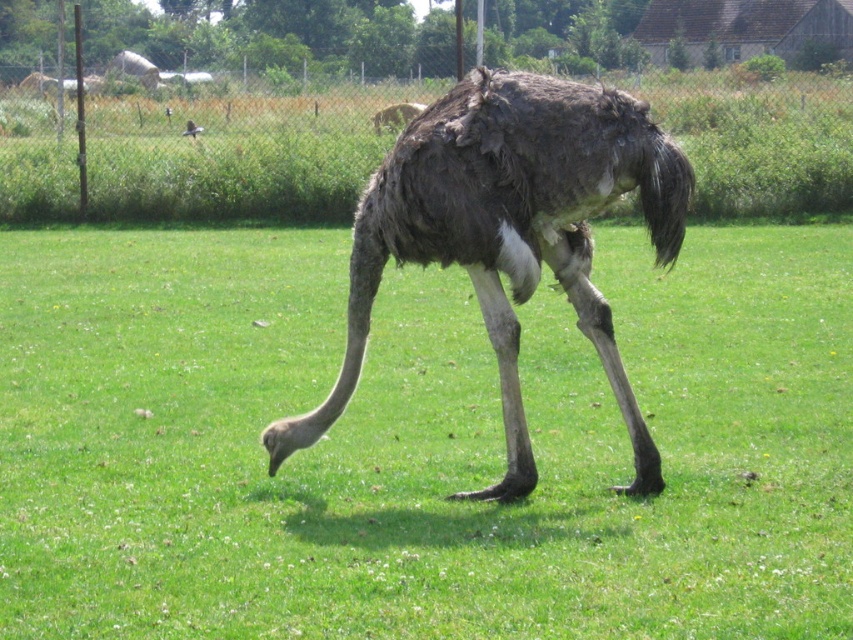
Question: Considering the relative positions of green grass at center and shiny black bird at upper left in the image provided, where is green grass at center located with respect to shiny black bird at upper left?

Choices:
 (A) left
 (B) right

Answer: (B)

Question: Which object is positioned farthest from the green grass at center?

Choices:
 (A) dark brown feathers at center
 (B) shiny black bird at upper left
 (C) brown feathered ostrich at center

Answer: (B)

Question: Among these objects, which one is farthest from the camera?

Choices:
 (A) brown feathered ostrich at center
 (B) dark brown feathers at center

Answer: (A)

Question: Which of these objects is positioned closest to the dark brown feathers at center?

Choices:
 (A) shiny black bird at upper left
 (B) green grass at center

Answer: (B)

Question: Can you confirm if brown feathered ostrich at center is positioned to the left of shiny black bird at upper left?

Choices:
 (A) no
 (B) yes

Answer: (A)

Question: Is green grass at center wider than dark brown feathers at center?

Choices:
 (A) yes
 (B) no

Answer: (A)